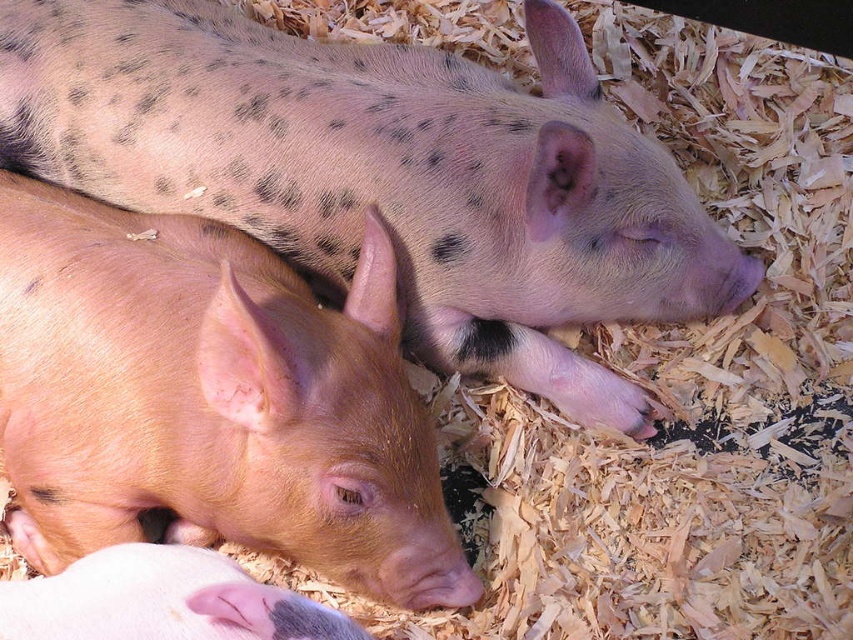
Question: Does pink smooth piglet at lower left appear on the right side of pink smooth skin at lower left?

Choices:
 (A) yes
 (B) no

Answer: (B)

Question: Which point is closer to the camera?

Choices:
 (A) [50, 323]
 (B) [94, 552]
 (C) [630, 173]

Answer: (B)

Question: Does pink smooth piglet at lower left have a greater width compared to pink smooth skin at lower left?

Choices:
 (A) no
 (B) yes

Answer: (B)

Question: Is pink smooth piglet at lower left further to camera compared to pink smooth skin at lower left?

Choices:
 (A) no
 (B) yes

Answer: (B)

Question: Which of the following is the closest to the observer?

Choices:
 (A) pink smooth skin at lower left
 (B) spotted pink pig at upper center
 (C) pink smooth piglet at lower left

Answer: (A)

Question: Which is nearer to the pink smooth skin at lower left?

Choices:
 (A) spotted pink pig at upper center
 (B) pink smooth piglet at lower left

Answer: (B)